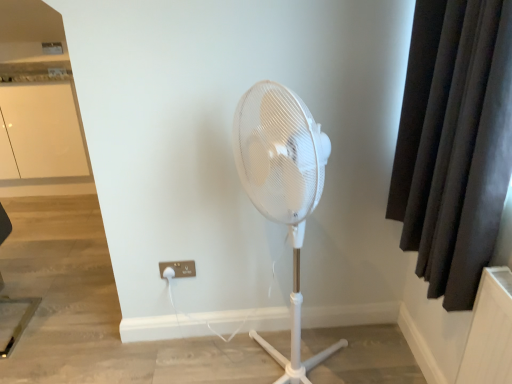
You are a GUI agent. You are given a task and a screenshot of the screen. Output one action in this format:
    pyautogui.click(x=<x>, y=<y>)
    Task: Click on the dark fabric curtain at right
    Image resolution: width=512 pixels, height=384 pixels.
    Given the screenshot: What is the action you would take?
    pyautogui.click(x=454, y=143)

At what (x,y) coordinates should I click in order to perform the action: click on white plastic electric outlet at lower center. Please return your answer as a coordinate pair (x, y). Image resolution: width=512 pixels, height=384 pixels. Looking at the image, I should click on (179, 268).

Considering the sizes of objects white glossy cabinet at upper left and dark fabric curtain at right in the image provided, who is bigger, white glossy cabinet at upper left or dark fabric curtain at right?

With larger size is white glossy cabinet at upper left.

Which of these two, white glossy cabinet at upper left or dark fabric curtain at right, stands shorter?

dark fabric curtain at right.

Is there a large distance between white glossy cabinet at upper left and dark fabric curtain at right?

Absolutely, white glossy cabinet at upper left is distant from dark fabric curtain at right.

Between point (8, 170) and point (191, 264), which one is positioned in front?

The point (191, 264) is closer.

Does white glossy cabinet at upper left have a lesser height compared to white plastic electric outlet at lower center?

No, white glossy cabinet at upper left is not shorter than white plastic electric outlet at lower center.

From the image's perspective, is white glossy cabinet at upper left above or below white plastic electric outlet at lower center?

From the image's perspective, white glossy cabinet at upper left appears above white plastic electric outlet at lower center.

Is white glossy cabinet at upper left directly adjacent to white plastic electric outlet at lower center?

They are not placed beside each other.

From a real-world perspective, which is physically below, dark fabric curtain at right or white glossy cabinet at upper left?

white glossy cabinet at upper left, from a real-world perspective.

Considering the sizes of dark fabric curtain at right and white glossy cabinet at upper left in the image, is dark fabric curtain at right bigger or smaller than white glossy cabinet at upper left?

In the image, dark fabric curtain at right appears to be smaller than white glossy cabinet at upper left.

Which of these two, white plastic electric outlet at lower center or dark fabric curtain at right, stands taller?

With more height is dark fabric curtain at right.

This screenshot has height=384, width=512. What are the coordinates of `curtain that appears above the white plastic electric outlet at lower center (from a real-world perspective)` in the screenshot? It's located at (454, 143).

Which is more to the left, white plastic electric outlet at lower center or dark fabric curtain at right?

Positioned to the left is white plastic electric outlet at lower center.

Considering the points (176, 266) and (496, 188), which point is behind, point (176, 266) or point (496, 188)?

The point (176, 266) is more distant.

Is white plastic electric outlet at lower center looking in the opposite direction of white glossy cabinet at upper left?

white plastic electric outlet at lower center does not have its back to white glossy cabinet at upper left.

Could you measure the distance between white plastic electric outlet at lower center and white glossy cabinet at upper left?

1.80 meters.

Can you tell me how much white plastic electric outlet at lower center and white glossy cabinet at upper left differ in facing direction?

The angular difference between white plastic electric outlet at lower center and white glossy cabinet at upper left is 1.06 degrees.

Considering the positions of objects white plastic electric outlet at lower center and white glossy cabinet at upper left in the image provided, who is more to the right, white plastic electric outlet at lower center or white glossy cabinet at upper left?

From the viewer's perspective, white plastic electric outlet at lower center appears more on the right side.

Does point (494, 136) come closer to viewer compared to point (188, 269)?

Yes, point (494, 136) is in front of point (188, 269).

Between dark fabric curtain at right and white plastic electric outlet at lower center, which one appears on the right side from the viewer's perspective?

dark fabric curtain at right is more to the right.

Locate an element on the screen. The height and width of the screenshot is (384, 512). electric outlet that is under the dark fabric curtain at right (from a real-world perspective) is located at coordinates (179, 268).

Is white plastic electric outlet at lower center at the back of dark fabric curtain at right?

No, dark fabric curtain at right is not facing the opposite direction of white plastic electric outlet at lower center.

The height and width of the screenshot is (384, 512). Find the location of `screen door that is under the dark fabric curtain at right (from a real-world perspective)`. screen door that is under the dark fabric curtain at right (from a real-world perspective) is located at coordinates (41, 132).

Find the location of a particular element. The height and width of the screenshot is (384, 512). screen door behind the white plastic electric outlet at lower center is located at coordinates (41, 132).

Which object lies nearer to the anchor point white glossy cabinet at upper left, dark fabric curtain at right or white plastic electric outlet at lower center?

Among the two, white plastic electric outlet at lower center is located nearer to white glossy cabinet at upper left.

Based on their spatial positions, is white glossy cabinet at upper left or dark fabric curtain at right further from white plastic electric outlet at lower center?

Among the two, white glossy cabinet at upper left is located further to white plastic electric outlet at lower center.

Considering their positions, is white glossy cabinet at upper left positioned closer to dark fabric curtain at right than white plastic electric outlet at lower center?

The object closer to dark fabric curtain at right is white plastic electric outlet at lower center.

Looking at the image, which one is located further to white plastic electric outlet at lower center, dark fabric curtain at right or white glossy cabinet at upper left?

white glossy cabinet at upper left.

Considering their positions, is white plastic electric outlet at lower center positioned closer to white glossy cabinet at upper left than dark fabric curtain at right?

white plastic electric outlet at lower center is closer to white glossy cabinet at upper left.

When comparing their distances from dark fabric curtain at right, does white plastic electric outlet at lower center or white glossy cabinet at upper left seem further?

white glossy cabinet at upper left.

Identify the location of electric outlet located between white glossy cabinet at upper left and dark fabric curtain at right in the left-right direction. This screenshot has width=512, height=384. (179, 268).